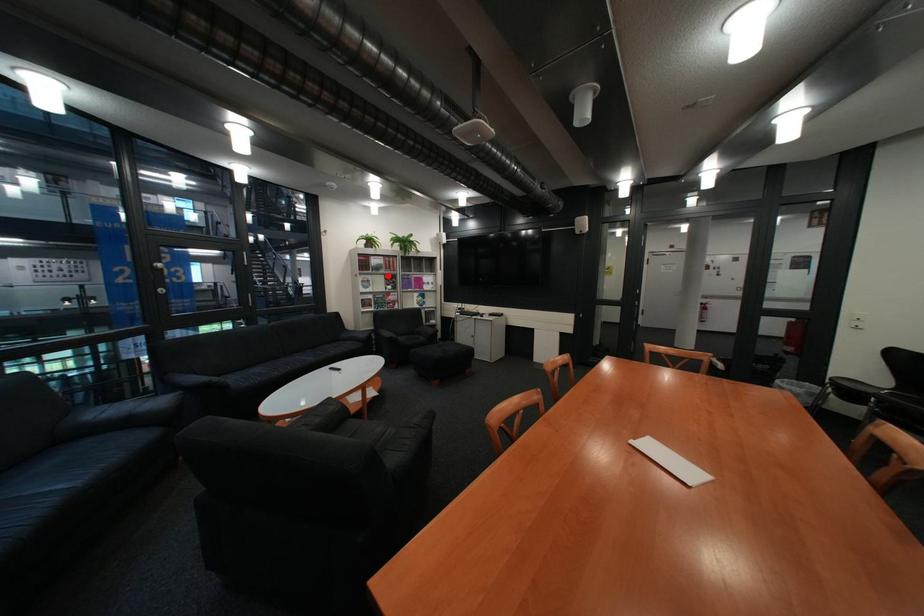
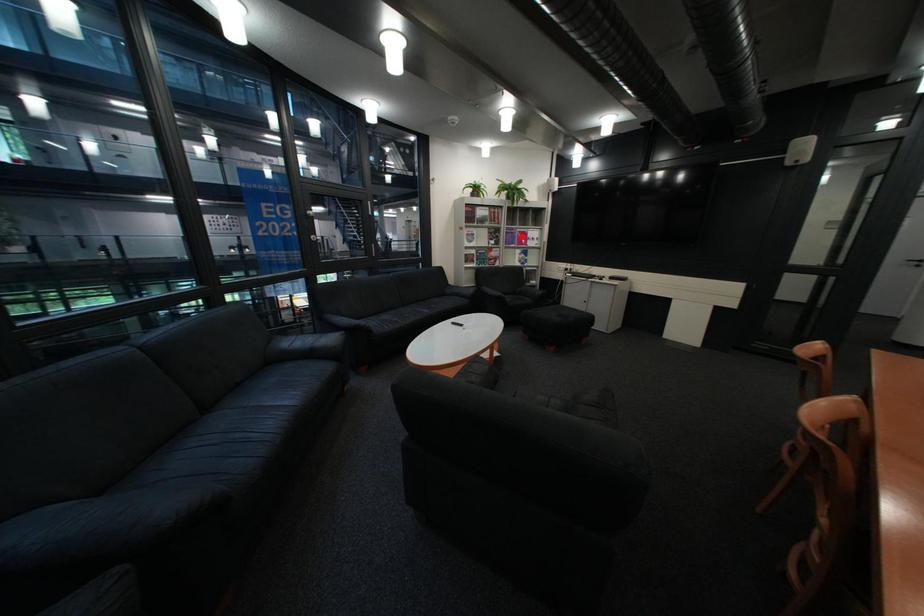
I am providing you with two images of the same scene from different viewpoints. A red point is marked on the first image and another point is marked on the second image. Do the highlighted points in image1 and image2 indicate the same real-world spot?

No